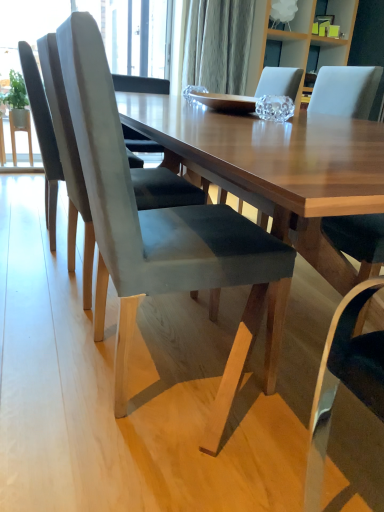
Locate an element on the screen. free space in front of suede gray chair at center, acting as the third chair starting from the back is located at coordinates (155, 470).